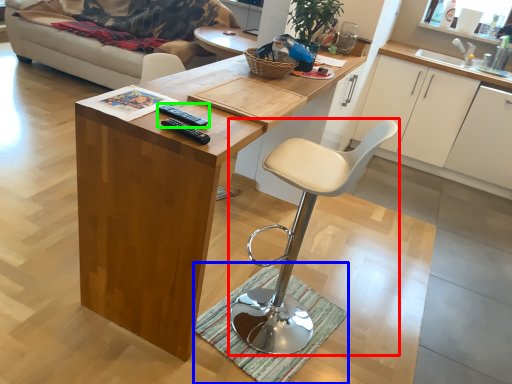
Question: Which object is the closest to the chair (highlighted by a red box)? Choose among these: doormat (highlighted by a blue box) or remote (highlighted by a green box).

Choices:
 (A) doormat
 (B) remote

Answer: (A)